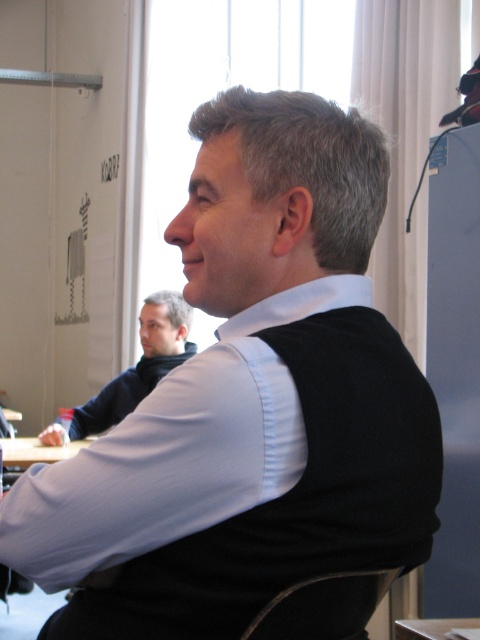
Does point (131, 381) come farther from viewer compared to point (10, 442)?

No.

This screenshot has height=640, width=480. In order to click on dark blue sweater at center in this screenshot , I will do `click(134, 369)`.

Looking at this image, who is higher up, black leather chair at lower center or wooden table at center?

black leather chair at lower center is above.

Is point (314, 596) positioned before point (476, 625)?

Yes, point (314, 596) is closer to viewer.

Is point (330, 602) less distant than point (441, 636)?

Yes, it is.

You are a GUI agent. You are given a task and a screenshot of the screen. Output one action in this format:
    pyautogui.click(x=<x>, y=<y>)
    Task: Click on the black leather chair at lower center
    This screenshot has width=480, height=640.
    Given the screenshot: What is the action you would take?
    pyautogui.click(x=323, y=605)

Is black leather chair at lower center wider than white wood table at lower left?

In fact, black leather chair at lower center might be narrower than white wood table at lower left.

Is black leather chair at lower center closer to camera compared to white wood table at lower left?

Yes, it is.

Find the location of `black leather chair at lower center`. black leather chair at lower center is located at coordinates (323, 605).